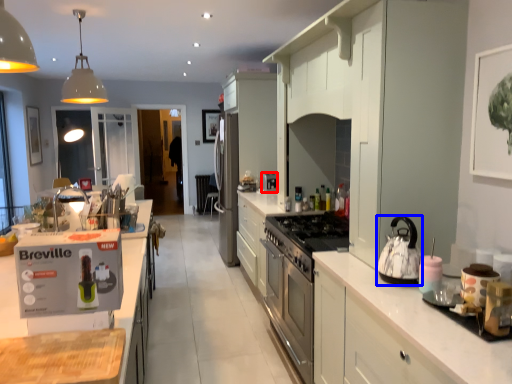
Question: Among these objects, which one is nearest to the camera, coffee machine (highlighted by a red box) or kitchen appliance (highlighted by a blue box)?

Choices:
 (A) coffee machine
 (B) kitchen appliance

Answer: (B)